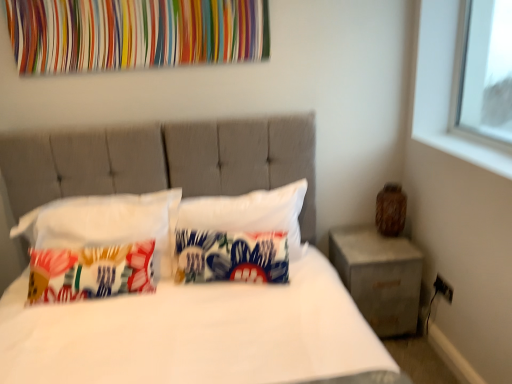
Question: Can you confirm if white fabric bed at center is wider than concrete/rough concrete nightstand at right?

Choices:
 (A) no
 (B) yes

Answer: (B)

Question: Is white fabric bed at center bigger than concrete/rough concrete nightstand at right?

Choices:
 (A) yes
 (B) no

Answer: (A)

Question: Does white fabric bed at center touch concrete/rough concrete nightstand at right?

Choices:
 (A) yes
 (B) no

Answer: (B)

Question: Considering the relative positions of white fabric bed at center and concrete/rough concrete nightstand at right in the image provided, is white fabric bed at center in front of concrete/rough concrete nightstand at right?

Choices:
 (A) yes
 (B) no

Answer: (A)

Question: Is concrete/rough concrete nightstand at right inside white fabric bed at center?

Choices:
 (A) no
 (B) yes

Answer: (A)

Question: Considering the positions of white fabric pillow at center, the third pillow when ordered from left to right, and multicolored fabric at upper center in the image, is white fabric pillow at center, the third pillow when ordered from left to right, taller or shorter than multicolored fabric at upper center?

Choices:
 (A) short
 (B) tall

Answer: (B)

Question: Is point (237, 238) closer or farther from the camera than point (20, 18)?

Choices:
 (A) farther
 (B) closer

Answer: (A)

Question: From a real-world perspective, is white fabric pillow at center, the 1th pillow in the right-to-left sequence, positioned above or below multicolored fabric at upper center?

Choices:
 (A) above
 (B) below

Answer: (B)

Question: Considering the relative positions of white fabric pillow at center, the 1th pillow in the right-to-left sequence, and multicolored fabric at upper center in the image provided, is white fabric pillow at center, the 1th pillow in the right-to-left sequence, to the left or to the right of multicolored fabric at upper center?

Choices:
 (A) right
 (B) left

Answer: (A)

Question: Does point (140, 251) appear closer or farther from the camera than point (294, 288)?

Choices:
 (A) farther
 (B) closer

Answer: (A)

Question: Considering the positions of printed fabric pillow at left, marked as the 1th pillow in a left-to-right arrangement, and white fabric bed at center in the image, is printed fabric pillow at left, marked as the 1th pillow in a left-to-right arrangement, bigger or smaller than white fabric bed at center?

Choices:
 (A) small
 (B) big

Answer: (A)

Question: From a real-world perspective, is printed fabric pillow at left, marked as the 1th pillow in a left-to-right arrangement, physically located above or below white fabric bed at center?

Choices:
 (A) above
 (B) below

Answer: (A)

Question: In terms of height, does printed fabric pillow at left, marked as the third pillow in a right-to-left arrangement, look taller or shorter compared to white fabric bed at center?

Choices:
 (A) short
 (B) tall

Answer: (A)

Question: From the image's perspective, is printed fabric pillow at left, marked as the third pillow in a right-to-left arrangement, positioned above or below concrete/rough concrete nightstand at right?

Choices:
 (A) below
 (B) above

Answer: (B)

Question: From a real-world perspective, is printed fabric pillow at left, marked as the third pillow in a right-to-left arrangement, above or below concrete/rough concrete nightstand at right?

Choices:
 (A) above
 (B) below

Answer: (A)